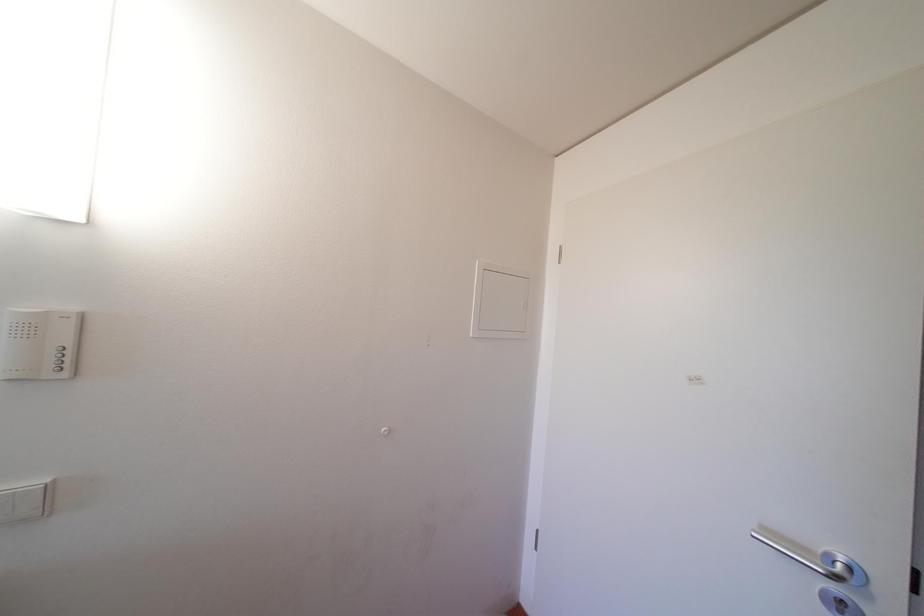
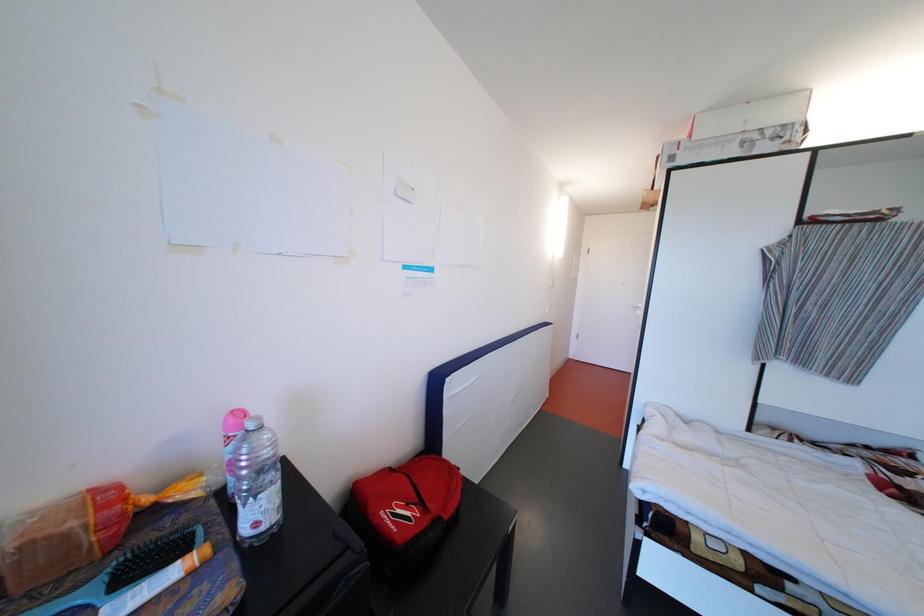
Looking at this image, in a continuous first-person perspective shot, in which direction is the camera moving?

The cameraman walked toward left, backward.